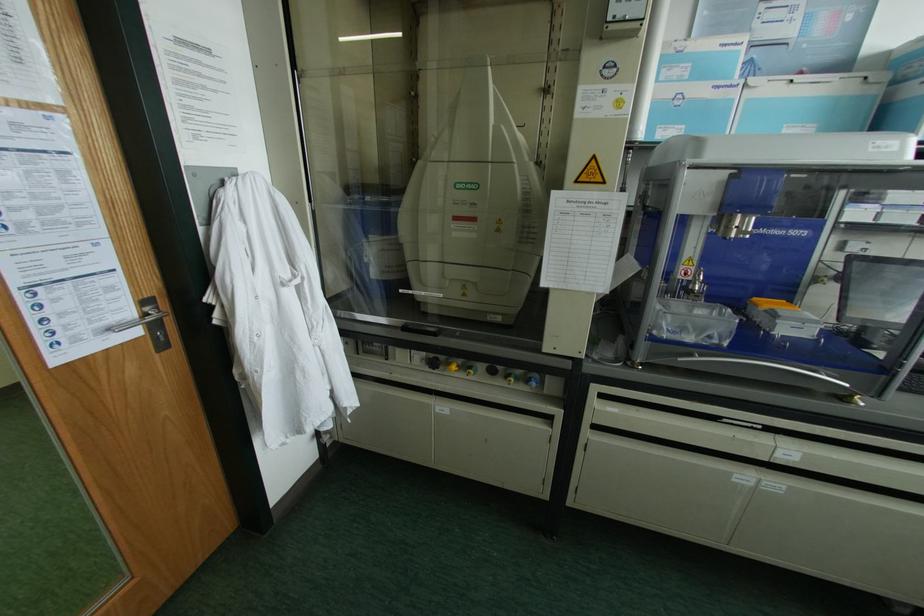
I want to click on yellow control knob, so click(x=452, y=366).